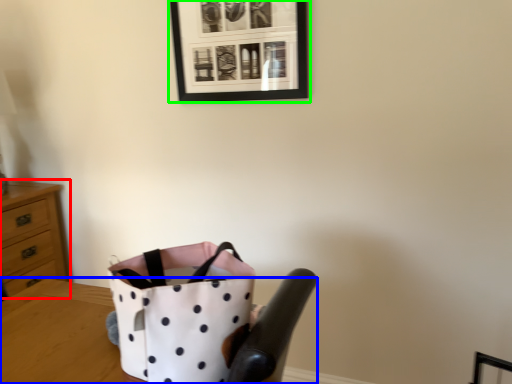
Question: Considering the real-world distances, which object is farthest from chest of drawers (highlighted by a red box)? table (highlighted by a blue box) or picture frame (highlighted by a green box)?

Choices:
 (A) table
 (B) picture frame

Answer: (B)